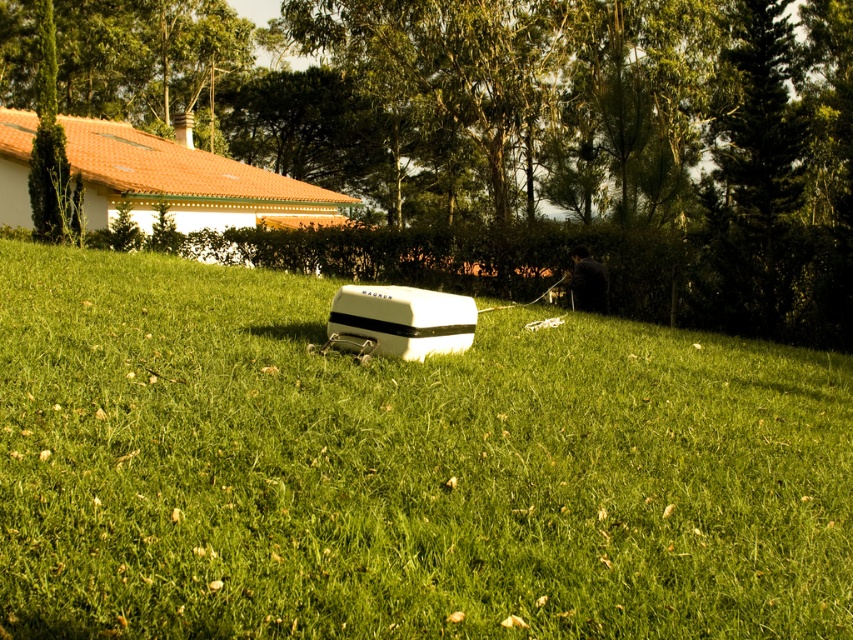
Question: Can you confirm if green grassy at center is positioned to the right of green leafy tree at center?

Choices:
 (A) yes
 (B) no

Answer: (A)

Question: Among these points, which one is farthest from the camera?

Choices:
 (A) (354, 253)
 (B) (329, 444)

Answer: (A)

Question: Can you confirm if green grassy at center is positioned to the left of green leafy tree at center?

Choices:
 (A) yes
 (B) no

Answer: (B)

Question: Which point is farther to the camera?

Choices:
 (A) (196, 308)
 (B) (241, 179)

Answer: (B)

Question: Does green grassy at center have a lesser width compared to green leafy tree at center?

Choices:
 (A) yes
 (B) no

Answer: (A)